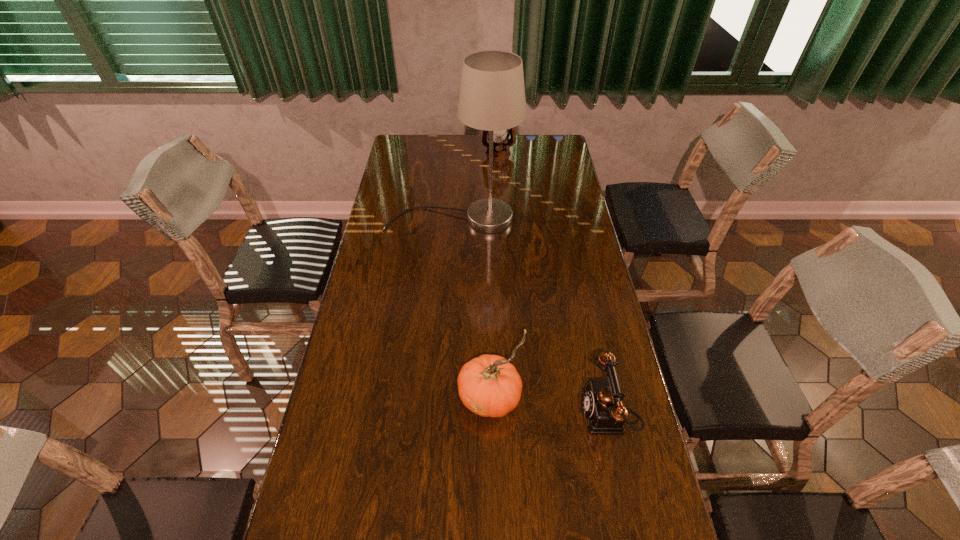
Find the location of a particular element. The width and height of the screenshot is (960, 540). the tallest object is located at coordinates (492, 95).

You are a GUI agent. You are given a task and a screenshot of the screen. Output one action in this format:
    pyautogui.click(x=<x>, y=<y>)
    Task: Click on the second farthest object
    
    Given the screenshot: What is the action you would take?
    pyautogui.click(x=492, y=95)

You are a GUI agent. You are given a task and a screenshot of the screen. Output one action in this format:
    pyautogui.click(x=<x>, y=<y>)
    Task: Click on the farthest object
    The height and width of the screenshot is (540, 960).
    Given the screenshot: What is the action you would take?
    pyautogui.click(x=501, y=151)

Identify the location of pumpkin. (488, 385).

Find the location of a particular element. the shortest object is located at coordinates (602, 400).

This screenshot has width=960, height=540. In order to click on telephone in this screenshot , I will do `click(602, 400)`.

The width and height of the screenshot is (960, 540). Find the location of `free location located on the back of the table lamp`. free location located on the back of the table lamp is located at coordinates (455, 179).

In order to click on vacant space located on the side of the farthest object, there is a wick adjustment knob in this screenshot , I will do `click(500, 183)`.

At what (x,y) coordinates should I click in order to perform the action: click on vacant space positioned 0.090m on the left of the pumpkin. Please return your answer as a coordinate pair (x, y). Looking at the image, I should click on (424, 397).

The image size is (960, 540). Find the location of `vacant space located 0.310m on the front of the telephone at the rotary dial`. vacant space located 0.310m on the front of the telephone at the rotary dial is located at coordinates (464, 414).